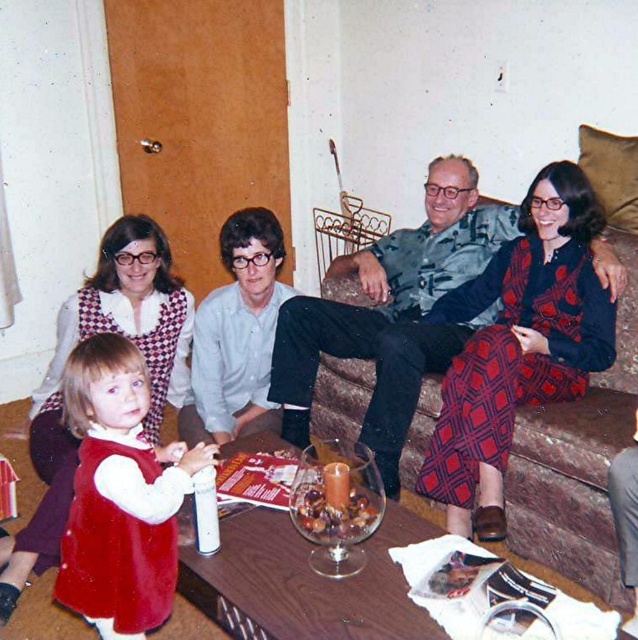
Question: Which object is farther from the camera taking this photo?

Choices:
 (A) velvet red dress at lower left
 (B) patterned fabric dress at center

Answer: (B)

Question: Does patterned fabric dress at center have a smaller size compared to velvet red dress at lower left?

Choices:
 (A) no
 (B) yes

Answer: (A)

Question: Can you confirm if patterned fabric dress at center is smaller than velvet red dress at lower left?

Choices:
 (A) no
 (B) yes

Answer: (A)

Question: Can you confirm if patterned fabric dress at center is positioned to the right of velvet red dress at lower left?

Choices:
 (A) no
 (B) yes

Answer: (B)